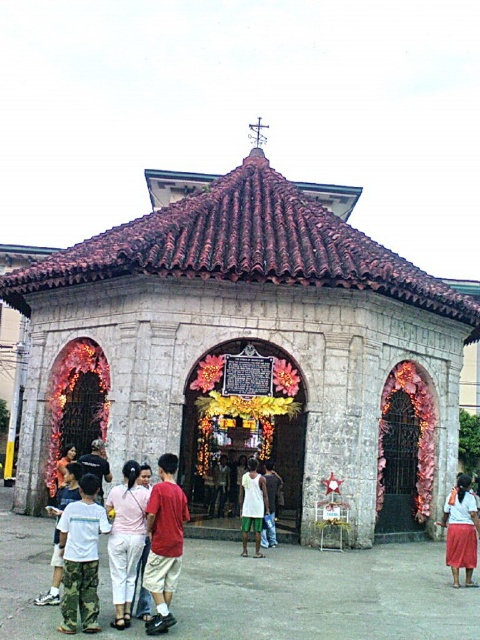
Question: Is stone temple at center wider than pink fabric pants at center?

Choices:
 (A) no
 (B) yes

Answer: (B)

Question: Which point appears closest to the camera in this image?

Choices:
 (A) (108, 264)
 (B) (154, 520)

Answer: (B)

Question: Observing the image, what is the correct spatial positioning of pink fabric pants at center in reference to white matte shirt at center?

Choices:
 (A) below
 (B) above

Answer: (B)

Question: Which object is farther from the camera taking this photo?

Choices:
 (A) stone temple at center
 (B) red cotton shirt at center

Answer: (A)

Question: Which of the following is the closest to the observer?

Choices:
 (A) (171, 554)
 (B) (115, 518)
 (C) (81, 314)
 (D) (474, 496)

Answer: (A)

Question: Does red cotton shirt at center appear over pink fabric pants at center?

Choices:
 (A) no
 (B) yes

Answer: (A)